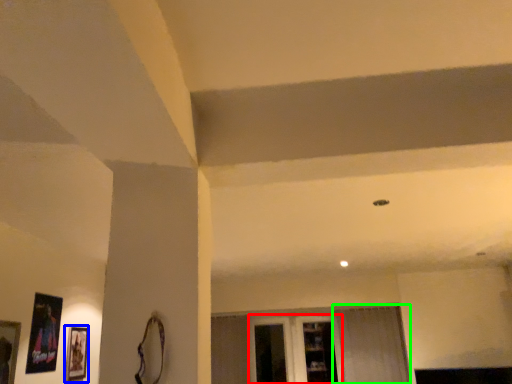
Question: Estimate the real-world distances between objects in this image. Which object is farther from glass door (highlighted by a red box), picture frame (highlighted by a blue box) or curtain (highlighted by a green box)?

Choices:
 (A) picture frame
 (B) curtain

Answer: (A)